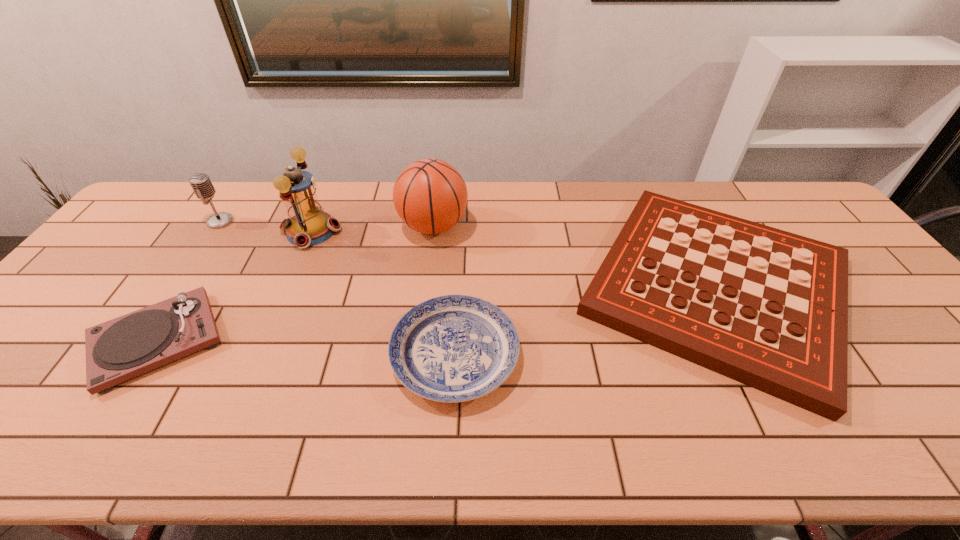
Locate an element on the screen. This screenshot has height=540, width=960. lantern present at the far edge is located at coordinates (308, 225).

Where is `basketball that is at the far edge`? basketball that is at the far edge is located at coordinates (430, 196).

This screenshot has width=960, height=540. Identify the location of microphone located in the far edge section of the desktop. (201, 184).

You are a GUI agent. You are given a task and a screenshot of the screen. Output one action in this format:
    pyautogui.click(x=<x>, y=<y>)
    Task: Click on the object that is at the left edge
    This screenshot has height=540, width=960.
    Given the screenshot: What is the action you would take?
    pyautogui.click(x=117, y=350)

The height and width of the screenshot is (540, 960). In the image, there is a desktop. In order to click on free region at the far edge in this screenshot , I will do `click(728, 191)`.

I want to click on free space at the near edge, so click(x=258, y=433).

Locate an element on the screen. The height and width of the screenshot is (540, 960). vacant area at the left edge of the desktop is located at coordinates (72, 321).

The width and height of the screenshot is (960, 540). In the image, there is a desktop. What are the coordinates of `free space at the far left corner` in the screenshot? It's located at coord(151,220).

Locate an element on the screen. vacant area at the far right corner is located at coordinates (790, 184).

Identify the location of vacant space that's between the plate and the phonograph_record. (306, 347).